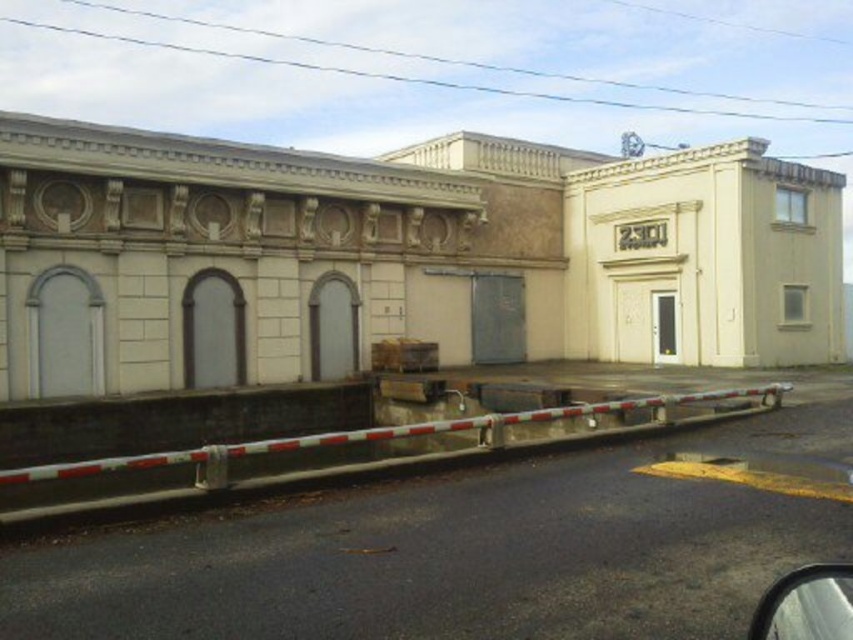
You are a delivery person with a cart that is 2 meters wide. You need to navigate from the white metallic barricade at lower center to the metallic silver mirror at lower right. Can your cart fit through the space between them?

The distance between the white metallic barricade at lower center and the metallic silver mirror at lower right is 12.33 meters. Since your cart is only 2 meters wide, it can easily fit through the space between them.

You are a delivery person approaching the beige building with a package. You see the white metallic barricade at lower center and the metallic silver mirror at lower right. Which object is closer to the building entrance on the right side?

The metallic silver mirror at lower right is closer to the building entrance on the right side because the white metallic barricade at lower center is positioned on the left side of it.

You are a delivery person with a cart that is 2 meters wide. You need to deliver a package to the entrance with the number 2301 sign. There is a white metallic barricade at lower center in your way. Can your cart pass through the gap between the barricade and the camera?

The gap between the white metallic barricade at lower center and the camera is 6.61 meters. Since your cart is only 2 meters wide, it can easily pass through the gap.